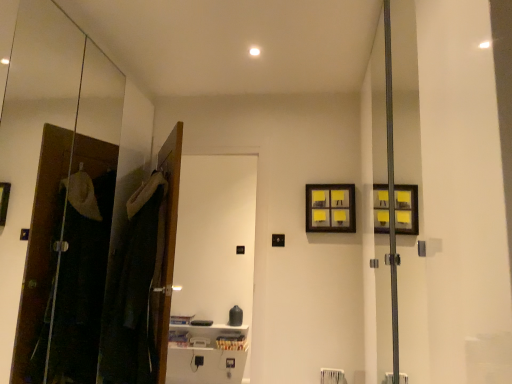
Question: Does yellow paper at upper right lie in front of dark fabric laundry at left?

Choices:
 (A) yes
 (B) no

Answer: (B)

Question: From a real-world perspective, does yellow paper at upper right stand above dark fabric laundry at left?

Choices:
 (A) yes
 (B) no

Answer: (A)

Question: Considering the relative sizes of yellow paper at upper right and dark fabric laundry at left in the image provided, is yellow paper at upper right bigger than dark fabric laundry at left?

Choices:
 (A) no
 (B) yes

Answer: (A)

Question: Considering the relative sizes of yellow paper at upper right and dark fabric laundry at left in the image provided, is yellow paper at upper right wider than dark fabric laundry at left?

Choices:
 (A) yes
 (B) no

Answer: (B)

Question: From the image's perspective, does yellow paper at upper right appear higher than dark fabric laundry at left?

Choices:
 (A) yes
 (B) no

Answer: (A)

Question: From their relative heights in the image, would you say dark fabric laundry at left is taller or shorter than yellow paper at upper right?

Choices:
 (A) tall
 (B) short

Answer: (A)

Question: Which is correct: dark fabric laundry at left is inside yellow paper at upper right, or outside of it?

Choices:
 (A) outside
 (B) inside

Answer: (A)

Question: Considering the positions of point (147, 288) and point (309, 213), is point (147, 288) closer or farther from the camera than point (309, 213)?

Choices:
 (A) closer
 (B) farther

Answer: (A)

Question: From a real-world perspective, relative to yellow paper at upper right, is dark fabric laundry at left vertically above or below?

Choices:
 (A) above
 (B) below

Answer: (B)

Question: Considering their positions, is dark fabric laundry at left located in front of or behind white glossy screen door at center?

Choices:
 (A) behind
 (B) front

Answer: (B)

Question: Is point (154, 274) positioned closer to the camera than point (227, 168)?

Choices:
 (A) closer
 (B) farther

Answer: (A)

Question: Considering the positions of dark fabric laundry at left and white glossy screen door at center in the image, is dark fabric laundry at left taller or shorter than white glossy screen door at center?

Choices:
 (A) tall
 (B) short

Answer: (B)

Question: Do you think dark fabric laundry at left is within white glossy screen door at center, or outside of it?

Choices:
 (A) inside
 (B) outside

Answer: (B)

Question: Is yellow paper at upper right to the left or to the right of dark fabric laundry at left in the image?

Choices:
 (A) right
 (B) left

Answer: (A)

Question: Does point (x=337, y=192) appear closer or farther from the camera than point (x=133, y=213)?

Choices:
 (A) farther
 (B) closer

Answer: (A)